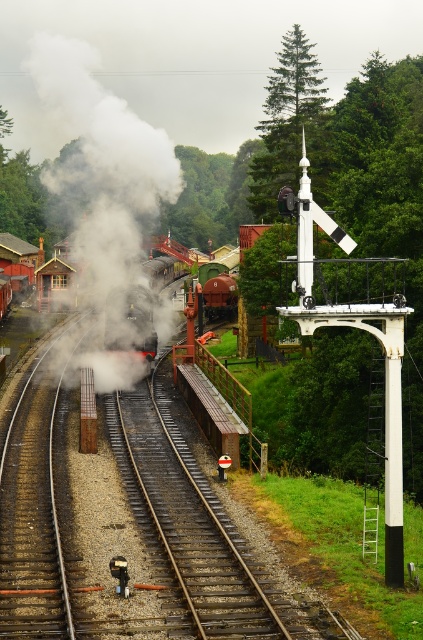
You are a photographer at the railway station. You want to capture the white matte steam at center in your photo. The camera is set to focus at point coordinates of 0.256, 0.243. Will the steam be in focus?

Yes, the white matte steam at center is exactly at point coordinates of (102, 163), so it will be in focus.

You are a photographer aiming to capture the steam from the train without the train track in the foreground. Based on the scene, can the white matte steam at center block the view of the rusty metal train track at center?

The white matte steam at center might be wider than rusty metal train track at center, so there is a possibility that the steam could obscure the track depending on their relative positions and the steam density.

You are a photographer at the railway station trying to capture the steam locomotive. You notice the white matte steam at center and the rusty metal train track at center. Which object is closer to the camera based on their positions?

The white matte steam at center is closer to the camera because the rusty metal train track at center is behind it.